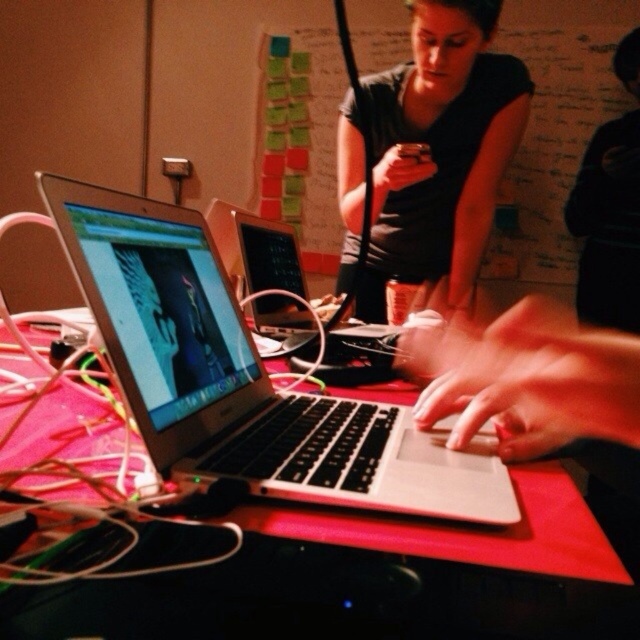
Looking at this image, which of these two, pink fabric at center or silver metallic laptop at center, stands shorter?

With less height is pink fabric at center.

Does point (259, 548) come behind point (253, 225)?

That is False.

This screenshot has width=640, height=640. Identify the location of pink fabric at center. (296, 604).

Does point (637, 170) lie behind point (252, 291)?

Yes, point (637, 170) is behind point (252, 291).

Can you confirm if black fabric shirt at upper center is thinner than silver metallic laptop at center?

Indeed, black fabric shirt at upper center has a lesser width compared to silver metallic laptop at center.

I want to click on black fabric shirt at upper center, so click(609, 209).

Who is taller, silver/black laptop at center or smooth skin hands at center?

Standing taller between the two is silver/black laptop at center.

Is silver/black laptop at center smaller than smooth skin hands at center?

Yes, silver/black laptop at center is smaller than smooth skin hands at center.

Between point (474, 484) and point (488, 330), which one is positioned in front?

Point (474, 484)

You are a GUI agent. You are given a task and a screenshot of the screen. Output one action in this format:
    pyautogui.click(x=<x>, y=<y>)
    Task: Click on the silver/black laptop at center
    
    Given the screenshot: What is the action you would take?
    pyautogui.click(x=243, y=378)